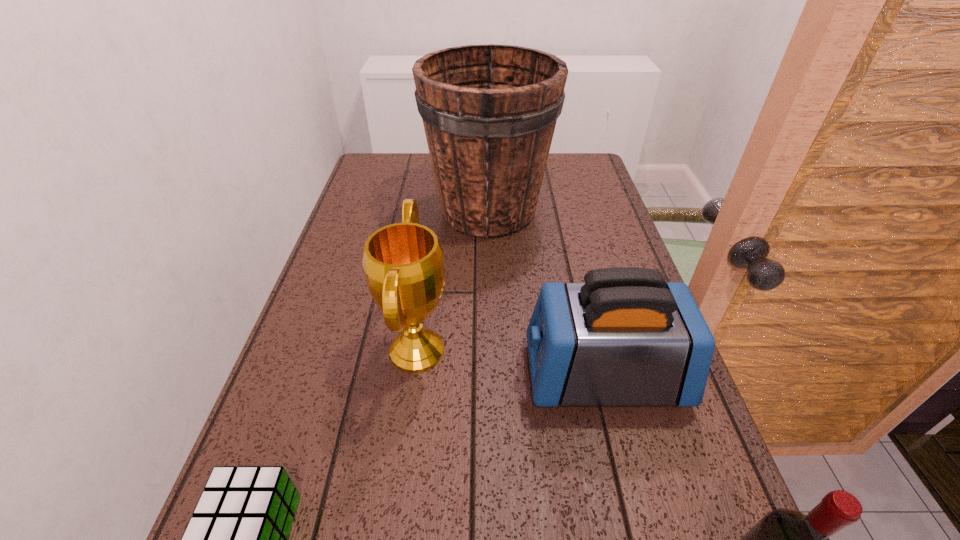
The image size is (960, 540). I want to click on bucket, so click(x=489, y=111).

Image resolution: width=960 pixels, height=540 pixels. I want to click on the farthest object, so pyautogui.click(x=489, y=111).

I want to click on award, so point(403,262).

Where is `toaster`? This screenshot has width=960, height=540. toaster is located at coordinates (626, 337).

You are a GUI agent. You are given a task and a screenshot of the screen. Output one action in this format:
    pyautogui.click(x=<x>, y=<y>)
    Task: Click on the vacant space located 0.150m on the front of the farthest object
    This screenshot has height=540, width=960.
    Given the screenshot: What is the action you would take?
    pyautogui.click(x=490, y=286)

Find the location of a particular element. The width and height of the screenshot is (960, 540). vacant space located 0.230m on the front-facing side of the award is located at coordinates (557, 350).

At what (x,y) coordinates should I click in order to perform the action: click on vacant space located 0.210m on the front-facing side of the toaster. Please return your answer as a coordinate pair (x, y). This screenshot has width=960, height=540. Looking at the image, I should click on (425, 375).

The width and height of the screenshot is (960, 540). I want to click on free spot located on the front-facing side of the toaster, so click(401, 375).

This screenshot has width=960, height=540. Identify the location of free location located on the front-facing side of the toaster. (411, 375).

The height and width of the screenshot is (540, 960). Find the location of `object located in the far edge section of the desktop`. object located in the far edge section of the desktop is located at coordinates (489, 111).